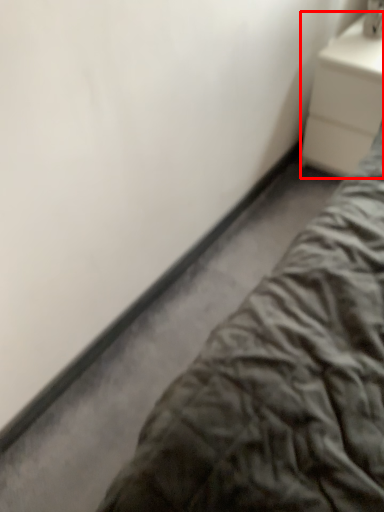
Question: In this image, where is nightstand (annotated by the red box) located relative to bed?

Choices:
 (A) left
 (B) right

Answer: (B)